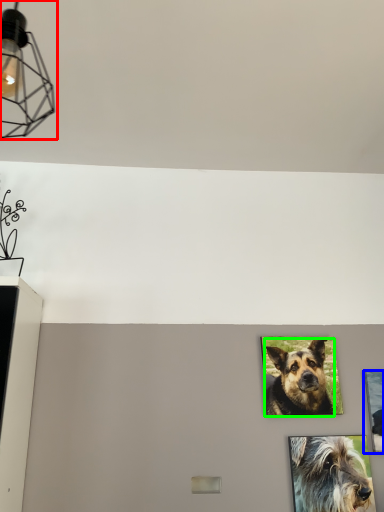
Question: Considering the real-world distances, which object is farthest from light fixture (highlighted by a red box)? picture frame (highlighted by a blue box) or dog (highlighted by a green box)?

Choices:
 (A) picture frame
 (B) dog

Answer: (A)